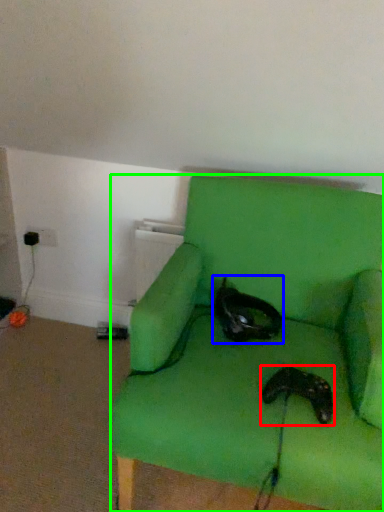
Question: Which is nearer to the footwear (highlighted by a red box)? cat (highlighted by a blue box) or chair (highlighted by a green box).

Choices:
 (A) cat
 (B) chair

Answer: (B)